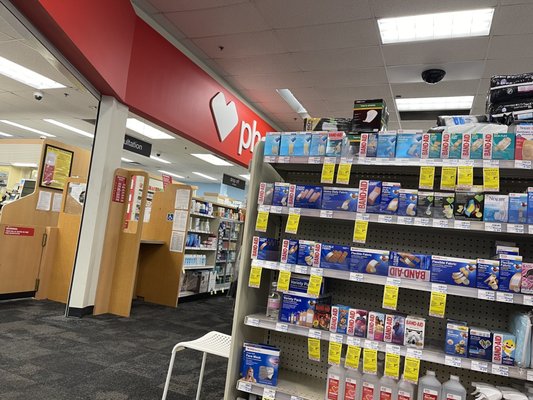
Locate an element on the screen. shelf is located at coordinates (339, 227).